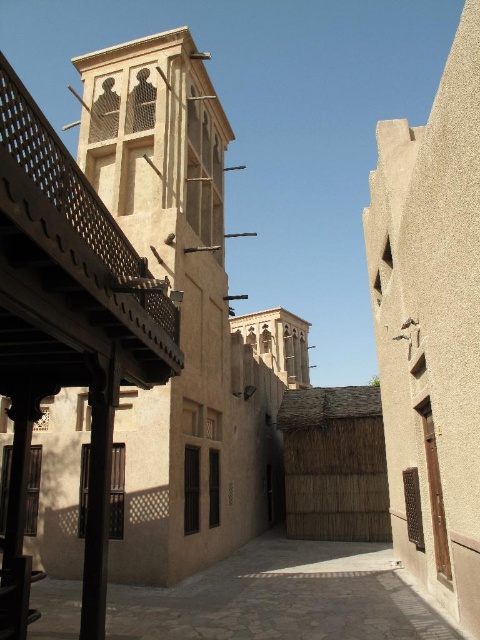
Question: Is beige textured tower at center to the left of brown textured courtyard at center from the viewer's perspective?

Choices:
 (A) no
 (B) yes

Answer: (B)

Question: Among these objects, which one is farthest from the camera?

Choices:
 (A) beige textured tower at center
 (B) brown textured courtyard at center

Answer: (A)

Question: Does beige textured tower at center have a lesser width compared to brown textured courtyard at center?

Choices:
 (A) yes
 (B) no

Answer: (A)

Question: Can you confirm if beige textured tower at center is positioned to the right of brown textured courtyard at center?

Choices:
 (A) yes
 (B) no

Answer: (B)

Question: Among these points, which one is farthest from the camera?

Choices:
 (A) (140, 605)
 (B) (181, 243)

Answer: (B)